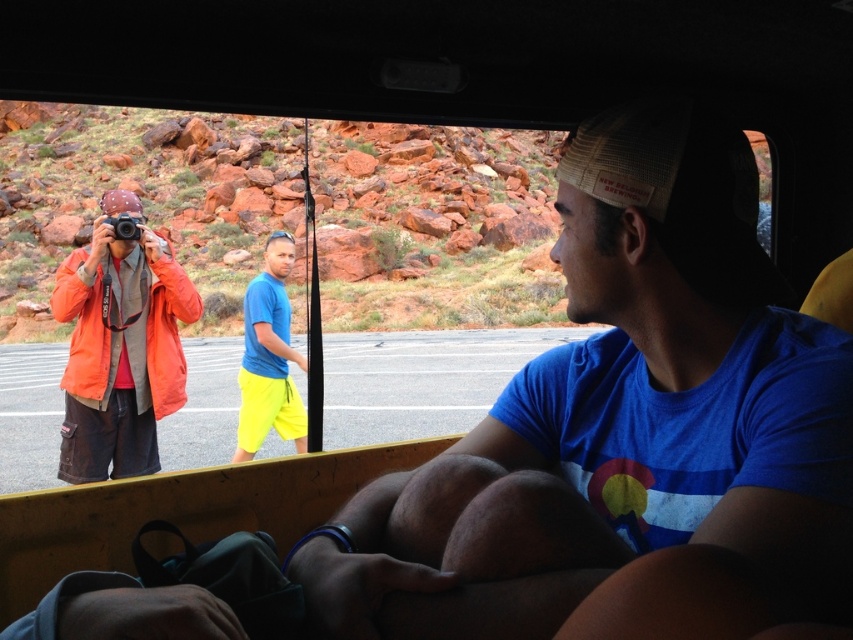
What is the location of the point with coordinates [120,346] in relation to the objects in the scene?

The point with coordinates [120,346] is located on the orange fabric jacket at left.

You are a passenger in the vehicle looking out the rear window. You notice the orange fabric jacket at left and the neon yellow shorts at center. Which object is positioned higher in the scene?

The orange fabric jacket at left is positioned higher than the neon yellow shorts at center in the scene.

You are a passenger in the vehicle looking out the rear window. You see the orange fabric jacket at left and the neon yellow shorts at center. Which object is positioned farther to the left?

The orange fabric jacket at left is positioned farther to the left than the neon yellow shorts at center.